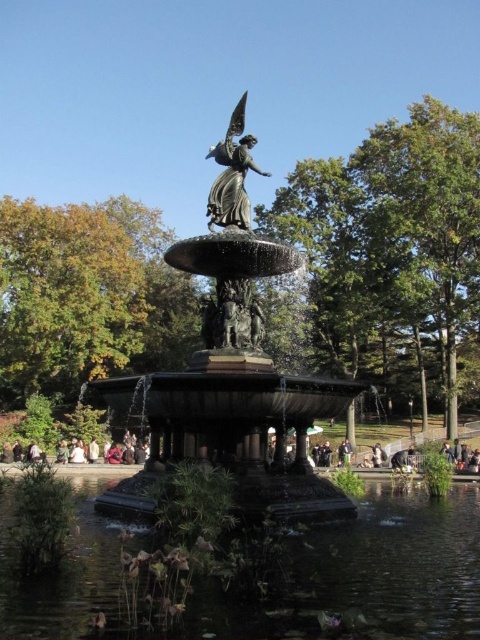
Question: Which is farther from the polished bronze statue at center?

Choices:
 (A) bronze statue at center
 (B) clear water at fountain center

Answer: (B)

Question: Does bronze statue at center appear on the left side of polished bronze statue at center?

Choices:
 (A) yes
 (B) no

Answer: (A)

Question: Which of the following is the farthest from the observer?

Choices:
 (A) (465, 577)
 (B) (224, 465)
 (C) (225, 200)

Answer: (C)

Question: Observing the image, what is the correct spatial positioning of clear water at fountain center in reference to polished bronze statue at center?

Choices:
 (A) right
 (B) left

Answer: (A)

Question: Is bronze statue at center above clear water at fountain center?

Choices:
 (A) yes
 (B) no

Answer: (A)

Question: Estimate the real-world distances between objects in this image. Which object is farther from the clear water at fountain center?

Choices:
 (A) polished bronze statue at center
 (B) bronze statue at center

Answer: (A)